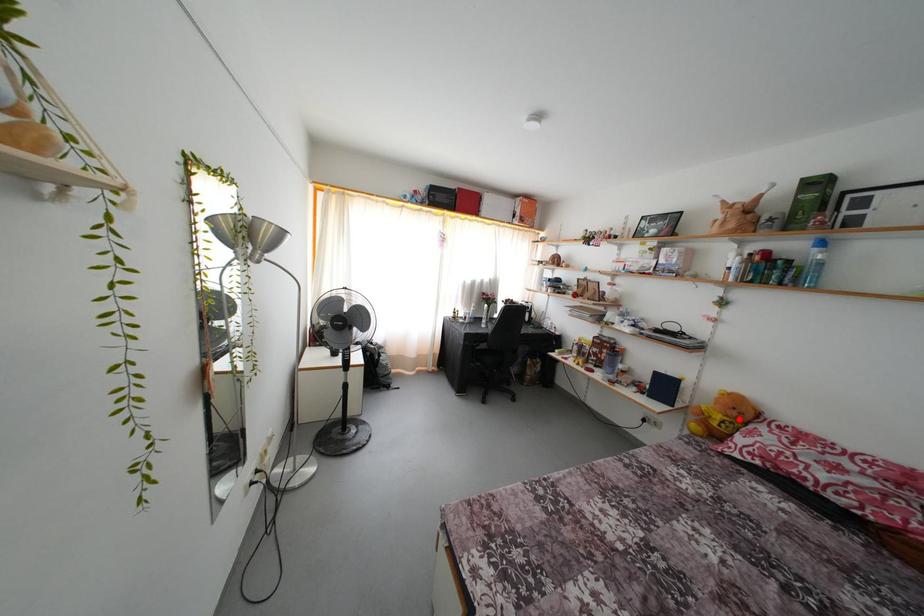
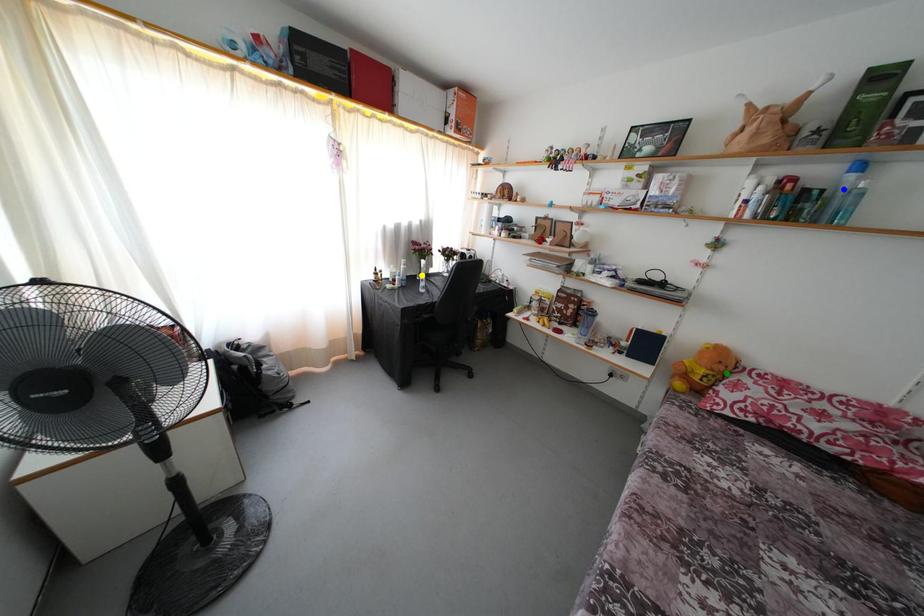
Question: I am providing you with two images of the same scene from different viewpoints. A red point is marked on the first image. You are given multiple points on the second image. Which mark in image 2 goes with the point in image 1?

Choices:
 (A) green point
 (B) yellow point
 (C) blue point

Answer: (A)